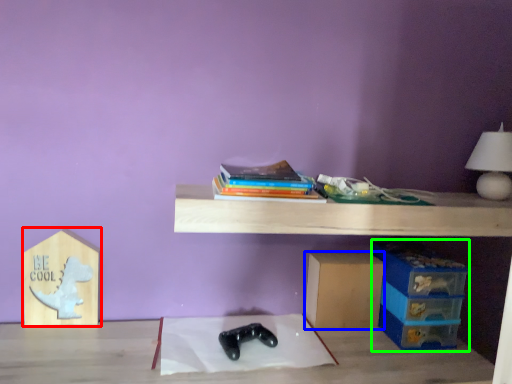
Question: Estimate the real-world distances between objects in this image. Which object is closer to cardboard box (highlighted by a red box), cardboard box (highlighted by a blue box) or storage box (highlighted by a green box)?

Choices:
 (A) cardboard box
 (B) storage box

Answer: (A)